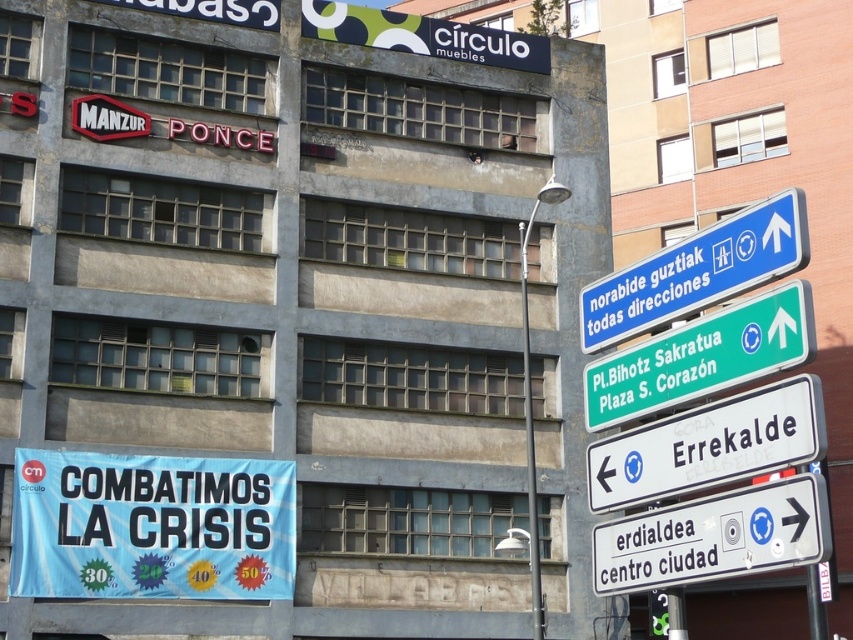
Question: Does blue plastic sign at upper right have a greater width compared to metallic pole at center?

Choices:
 (A) yes
 (B) no

Answer: (A)

Question: Which object appears farthest from the camera in this image?

Choices:
 (A) white plastic sign at right
 (B) metallic pole at center
 (C) white plastic sign at center right

Answer: (B)

Question: Is white plastic sign at center right closer to the viewer compared to metallic pole at center?

Choices:
 (A) yes
 (B) no

Answer: (A)

Question: Considering the real-world distances, which object is closest to the metallic pole at center?

Choices:
 (A) blue plastic sign at upper right
 (B) light blue fabric banner at lower left

Answer: (B)

Question: Which object appears closest to the camera in this image?

Choices:
 (A) light blue fabric banner at lower left
 (B) metallic pole at center
 (C) blue plastic sign at upper center

Answer: (C)

Question: Is white plastic sign at center right smaller than blue plastic sign at upper right?

Choices:
 (A) no
 (B) yes

Answer: (B)